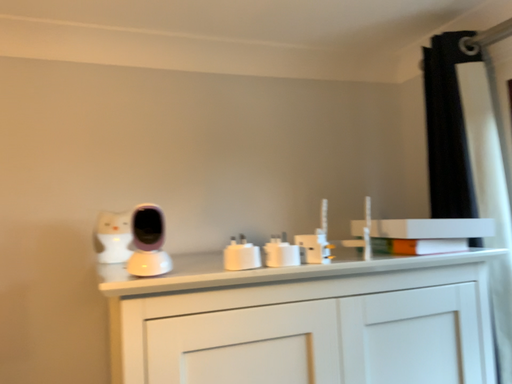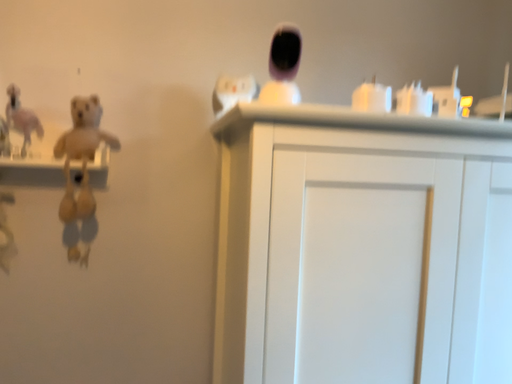
Question: How did the camera likely rotate when shooting the video?

Choices:
 (A) rotated left
 (B) rotated right

Answer: (A)